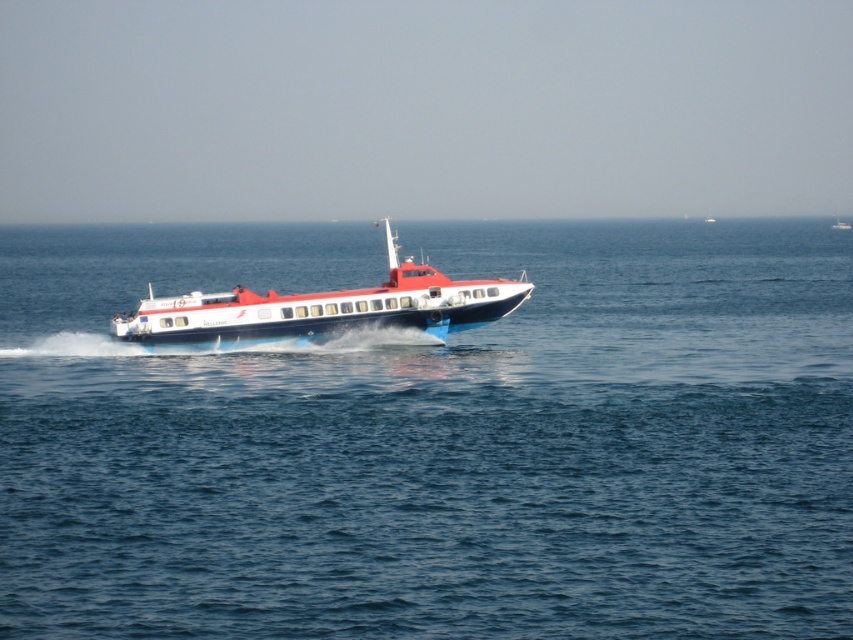
Question: Which point is closer to the camera?

Choices:
 (A) (527, 461)
 (B) (398, 300)

Answer: (A)

Question: Can you confirm if blue water at center is thinner than shiny blue and white boat at center?

Choices:
 (A) no
 (B) yes

Answer: (A)

Question: In this image, where is blue water at center located relative to shiny blue and white boat at center?

Choices:
 (A) left
 (B) right

Answer: (B)

Question: Can you confirm if blue water at center is positioned to the left of shiny blue and white boat at center?

Choices:
 (A) yes
 (B) no

Answer: (B)